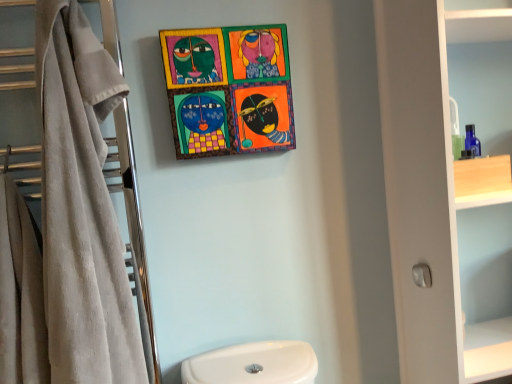
You are a GUI agent. You are given a task and a screenshot of the screen. Output one action in this format:
    pyautogui.click(x=<x>, y=<y>)
    Task: Click on the white matte cabinet at right
    Image resolution: width=512 pixels, height=384 pixels.
    Given the screenshot: What is the action you would take?
    (420, 189)

Image resolution: width=512 pixels, height=384 pixels. Describe the element at coordinates (420, 189) in the screenshot. I see `white matte cabinet at right` at that location.

Where is `wooden painted artwork at upper center`? wooden painted artwork at upper center is located at coordinates (229, 90).

Locate an element on the screen. This screenshot has height=384, width=512. beige soft towel at left is located at coordinates (20, 293).

You are a GUI agent. You are given a task and a screenshot of the screen. Output one action in this format:
    pyautogui.click(x=<x>, y=<y>)
    Task: Click on the beige towel at left
    The image size is (512, 384).
    Given the screenshot: What is the action you would take?
    pyautogui.click(x=134, y=233)

This screenshot has height=384, width=512. I want to click on white matte cabinet at right, so click(x=420, y=189).

Is white matte cabinet at right outside of beige soft towel at left?

Yes.

Considering the positions of objects white matte cabinet at right and beige soft towel at left in the image provided, who is in front, white matte cabinet at right or beige soft towel at left?

beige soft towel at left is more forward.

Between white matte cabinet at right and beige soft towel at left, which one has smaller width?

white matte cabinet at right.

Is white matte cabinet at right placed right next to beige soft towel at left?

No, white matte cabinet at right is not next to beige soft towel at left.

Does beige soft towel at left appear on the right side of white matte cabinet at right?

In fact, beige soft towel at left is to the left of white matte cabinet at right.

Considering the sizes of objects beige soft towel at left and white matte cabinet at right in the image provided, who is bigger, beige soft towel at left or white matte cabinet at right?

white matte cabinet at right is bigger.

From a real-world perspective, is beige soft towel at left positioned over white matte cabinet at right based on gravity?

No, from a real-world perspective, beige soft towel at left is not over white matte cabinet at right

How distant is wooden painted artwork at upper center from white matte cabinet at right?

The distance of wooden painted artwork at upper center from white matte cabinet at right is 19.37 inches.

Is wooden painted artwork at upper center at the right side of white matte cabinet at right?

Incorrect, wooden painted artwork at upper center is not on the right side of white matte cabinet at right.

Considering the sizes of objects wooden painted artwork at upper center and white matte cabinet at right in the image provided, who is shorter, wooden painted artwork at upper center or white matte cabinet at right?

wooden painted artwork at upper center.

Is wooden painted artwork at upper center touching white matte cabinet at right?

No, wooden painted artwork at upper center is not in contact with white matte cabinet at right.

Would you say beige soft towel at left contains wooden painted artwork at upper center?

No, beige soft towel at left does not contain wooden painted artwork at upper center.

From the image's perspective, is beige soft towel at left positioned above or below wooden painted artwork at upper center?

Clearly, from the image's perspective, beige soft towel at left is below wooden painted artwork at upper center.

Where is `bath towel that is on the left side of wooden painted artwork at upper center`? bath towel that is on the left side of wooden painted artwork at upper center is located at coordinates (20, 293).

Considering the relative positions of white matte cabinet at right and wooden painted artwork at upper center in the image provided, is white matte cabinet at right to the left or to the right of wooden painted artwork at upper center?

In the image, white matte cabinet at right appears on the right side of wooden painted artwork at upper center.

I want to click on picture frame that appears above the white matte cabinet at right (from the image's perspective), so click(229, 90).

Which of these two, white matte cabinet at right or wooden painted artwork at upper center, is smaller?

Smaller between the two is wooden painted artwork at upper center.

Which is in front, point (274, 77) or point (122, 121)?

Point (122, 121)

From the image's perspective, between wooden painted artwork at upper center and beige towel at left, which one is located above?

wooden painted artwork at upper center.

Looking at this image, between wooden painted artwork at upper center and beige towel at left, which one appears on the right side from the viewer's perspective?

wooden painted artwork at upper center.

How many degrees apart are the facing directions of beige soft towel at left and beige towel at left?

The angular difference between beige soft towel at left and beige towel at left is 0.699 degrees.

From the image's perspective, is beige soft towel at left under beige towel at left?

Yes, from the image's perspective, beige soft towel at left is below beige towel at left.

Considering the sizes of objects beige soft towel at left and beige towel at left in the image provided, who is thinner, beige soft towel at left or beige towel at left?

beige towel at left is thinner.

Could you tell me if beige soft towel at left is turned towards beige towel at left?

No, beige soft towel at left does not turn towards beige towel at left.

Locate an element on the screen. This screenshot has width=512, height=384. bathroom cabinet located above the beige soft towel at left (from a real-world perspective) is located at coordinates [x=420, y=189].

What are the coordinates of `bath towel that appears below the white matte cabinet at right (from a real-world perspective)` in the screenshot? It's located at (20, 293).

Looking at the image, which one is located closer to white matte cabinet at right, wooden painted artwork at upper center or beige towel at left?

wooden painted artwork at upper center.

When comparing their distances from beige soft towel at left, does white matte cabinet at right or wooden painted artwork at upper center seem closer?

wooden painted artwork at upper center is closer to beige soft towel at left.

Which object lies further to the anchor point beige soft towel at left, wooden painted artwork at upper center or white matte cabinet at right?

white matte cabinet at right is positioned further to the anchor beige soft towel at left.

Estimate the real-world distances between objects in this image. Which object is closer to wooden painted artwork at upper center, white matte cabinet at right or beige towel at left?

beige towel at left is positioned closer to the anchor wooden painted artwork at upper center.

Estimate the real-world distances between objects in this image. Which object is closer to wooden painted artwork at upper center, beige soft towel at left or white matte cabinet at right?

white matte cabinet at right is positioned closer to the anchor wooden painted artwork at upper center.

Considering their positions, is beige towel at left positioned further to white matte cabinet at right than beige soft towel at left?

beige soft towel at left is further to white matte cabinet at right.

Looking at the image, which one is located closer to beige towel at left, white matte cabinet at right or beige soft towel at left?

beige soft towel at left is positioned closer to the anchor beige towel at left.

Looking at the image, which one is located closer to white matte cabinet at right, beige soft towel at left or wooden painted artwork at upper center?

Among the two, wooden painted artwork at upper center is located nearer to white matte cabinet at right.

The width and height of the screenshot is (512, 384). In order to click on closet located between beige soft towel at left and white matte cabinet at right in the left-right direction in this screenshot , I will do `click(134, 233)`.

The width and height of the screenshot is (512, 384). I want to click on closet between wooden painted artwork at upper center and beige soft towel at left in the up-down direction, so click(134, 233).

Locate an element on the screen. This screenshot has height=384, width=512. picture frame situated between beige soft towel at left and white matte cabinet at right from left to right is located at coordinates (229, 90).

I want to click on picture frame between beige towel at left and white matte cabinet at right in the horizontal direction, so click(229, 90).